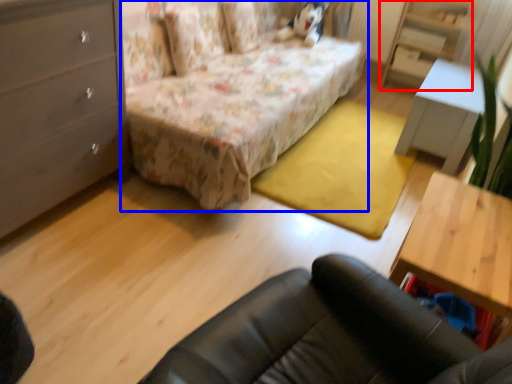
Question: Which point is closer to the camera, dresser (highlighted by a red box) or bed (highlighted by a blue box)?

Choices:
 (A) dresser
 (B) bed

Answer: (B)